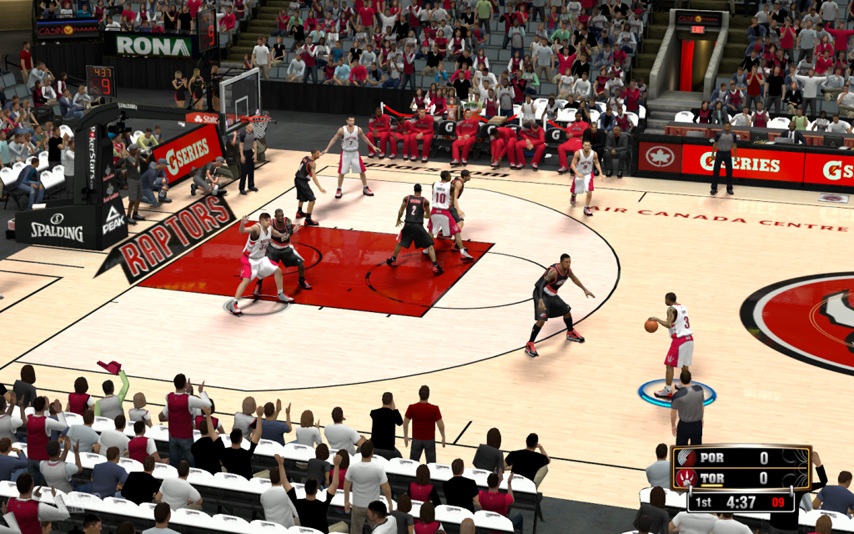
You are a GUI agent. You are given a task and a screenshot of the screen. Output one action in this format:
    pyautogui.click(x=<x>, y=<y>)
    Task: Click on the exit sign
    The width and height of the screenshot is (854, 534).
    Given the screenshot: What is the action you would take?
    pyautogui.click(x=698, y=30)